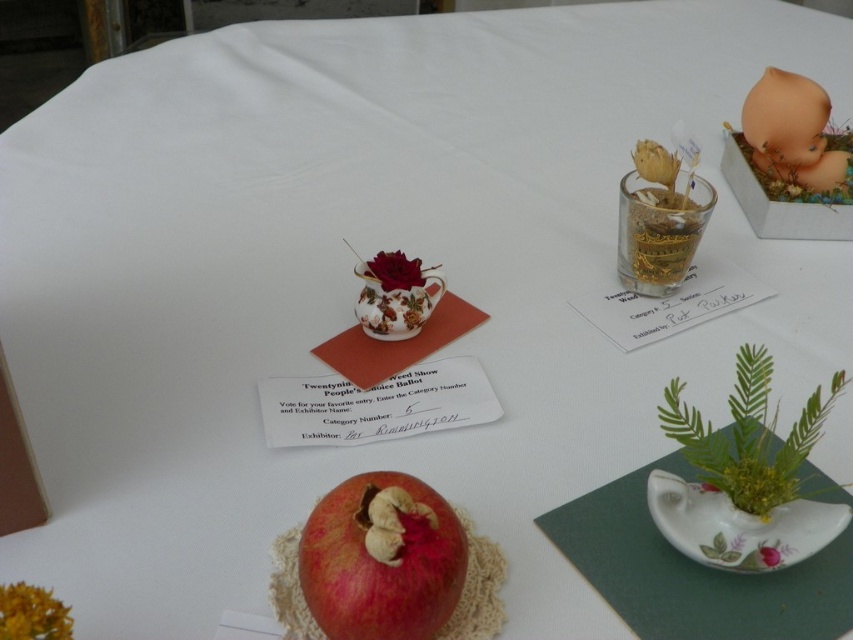
Question: Which is nearer to the matte ceramic flower at center right?

Choices:
 (A) shiny red pomegranate at center
 (B) floral-patterned ceramic teapot at center-left
 (C) yellow textured flower at lower left
 (D) matte floral cup at center

Answer: (A)

Question: Does shiny red pomegranate at center come in front of matte ceramic flower at center right?

Choices:
 (A) no
 (B) yes

Answer: (B)

Question: Can you confirm if shiny red pomegranate at center is thinner than floral-patterned ceramic teapot at center-left?

Choices:
 (A) no
 (B) yes

Answer: (A)

Question: Is floral-patterned ceramic teapot at center-left wider than matte floral cup at center?

Choices:
 (A) yes
 (B) no

Answer: (A)

Question: Which point is farther to the camera?

Choices:
 (A) click(30, 616)
 (B) click(410, 506)
 (C) click(776, 552)
 (D) click(822, 113)

Answer: (D)

Question: Based on their relative distances, which object is farther from the floral-patterned ceramic teapot at center-left?

Choices:
 (A) yellow textured flower at lower left
 (B) matte floral cup at center

Answer: (A)